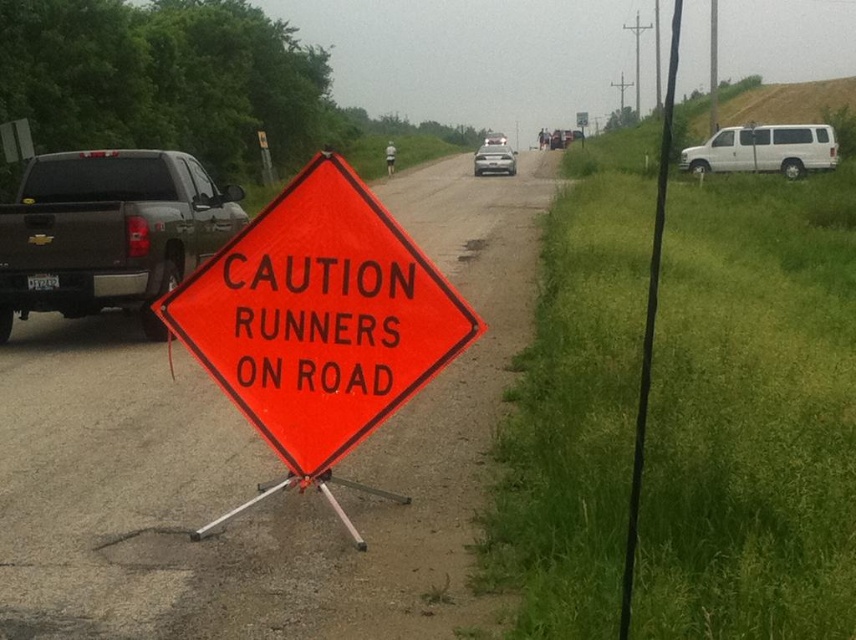
This screenshot has height=640, width=856. I want to click on orange diamond-shaped sign at center, so click(319, 317).

Describe the element at coordinates (319, 317) in the screenshot. The height and width of the screenshot is (640, 856). I see `orange diamond-shaped sign at center` at that location.

This screenshot has height=640, width=856. What are the coordinates of `orange diamond-shaped sign at center` in the screenshot? It's located at (319, 317).

Locate an element on the screen. This screenshot has height=640, width=856. orange diamond-shaped sign at center is located at coordinates (319, 317).

Does orange diamond-shaped sign at center have a greater width compared to white matte van at right?

In fact, orange diamond-shaped sign at center might be narrower than white matte van at right.

Who is higher up, orange diamond-shaped sign at center or white matte van at right?

white matte van at right is above.

This screenshot has width=856, height=640. I want to click on orange diamond-shaped sign at center, so click(x=319, y=317).

Is white matte van at right in front of silver metallic sedan at center?

Yes, white matte van at right is in front of silver metallic sedan at center.

Which is behind, point (794, 134) or point (503, 166)?

The point (503, 166) is behind.

You are a GUI agent. You are given a task and a screenshot of the screen. Output one action in this format:
    pyautogui.click(x=<x>, y=<y>)
    Task: Click on the white matte van at right
    
    Given the screenshot: What is the action you would take?
    pyautogui.click(x=764, y=148)

Identify the location of white matte van at right. (764, 148).